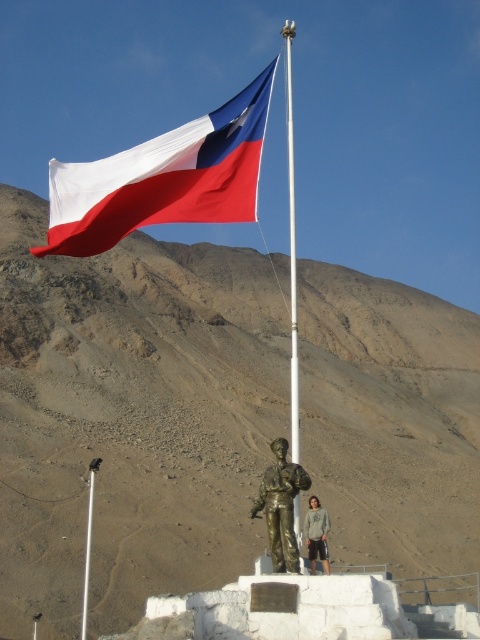
You are a photographer standing in front of the monument. You want to take a photo of the gray cotton hoodie at center without the matte fabric flag at upper center appearing in the frame. Is this possible based on their positions?

The matte fabric flag at upper center is positioned over the gray cotton hoodie at center, so it would block the view. Therefore, it is not possible to take a photo of the gray cotton hoodie at center without the flag appearing in the frame.

You are a photographer trying to capture the entire Chilean flag and the flagpole in one shot. Given that the matte fabric flag at upper center is larger than the white metallic pole at center, which object should you focus on first to ensure both are in frame?

The matte fabric flag at upper center is larger in size than the white metallic pole at center, so you should focus on the matte fabric flag at upper center first to ensure both are in frame.